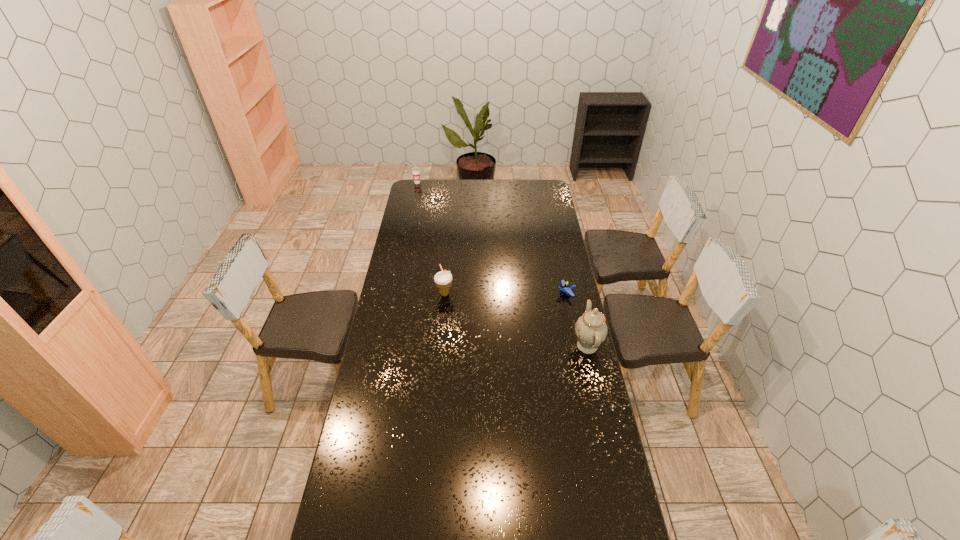
I want to click on vacant space on the desktop that is between the icecream and the tallest object and is positioned on the front-facing side of the shortest object, so click(x=491, y=310).

Locate an element on the screen. The image size is (960, 540). free space on the desktop that is between the icecream and the chinaware and is positioned on the side of the farthest object with the logo is located at coordinates (495, 312).